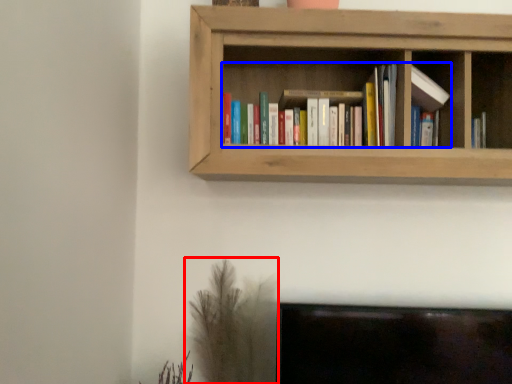
Question: Among these objects, which one is farthest to the camera, plant (highlighted by a red box) or book (highlighted by a blue box)?

Choices:
 (A) plant
 (B) book

Answer: (A)